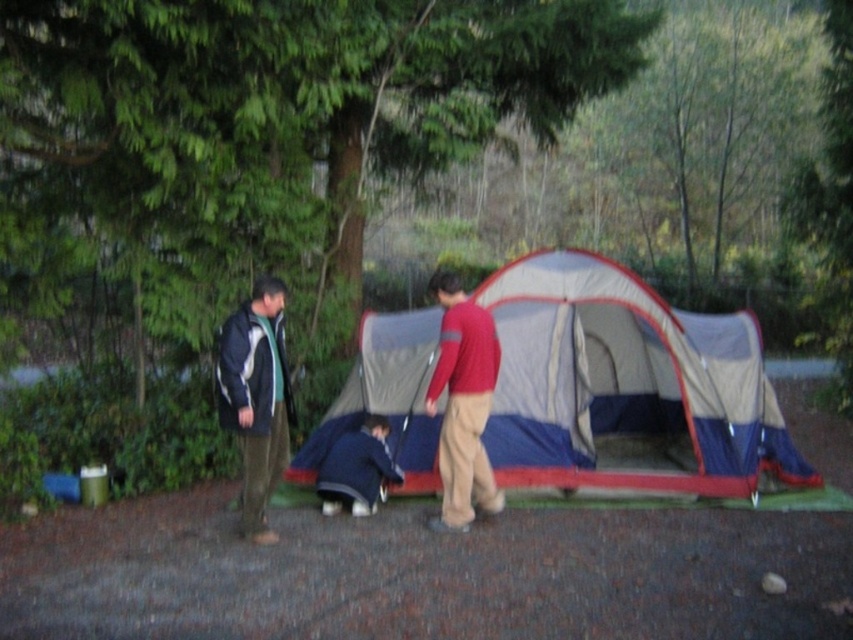
You are planning to set up a tent in this camping area. The blue fabric tent at center is already placed. Where should you place your tent to avoid overlapping with the existing one?

The blue fabric tent at center is located at coordinates point [625,387], so you should place your tent in an area that does not overlap with this position.

Looking at this image, you are standing at the origin point in the camping scene. The blue fabric tent at center is at point (625, 387). If you want to walk straight towards the tent, which direction should you move? Please answer with either north, south, east, or west.

To reach the blue fabric tent at center located at point (625, 387) from the origin, you should move east because the x coordinate increases from 0 to 0.605, indicating eastward direction.